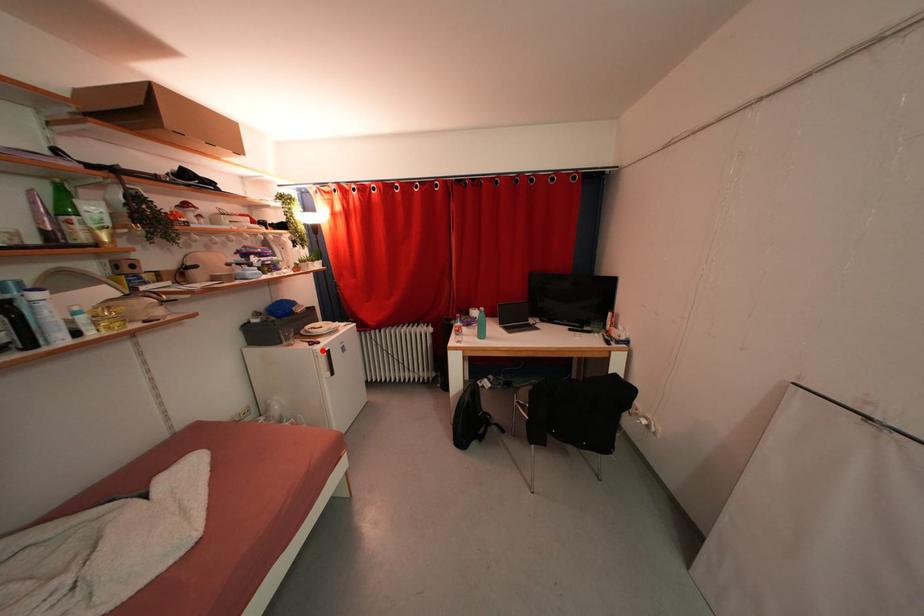
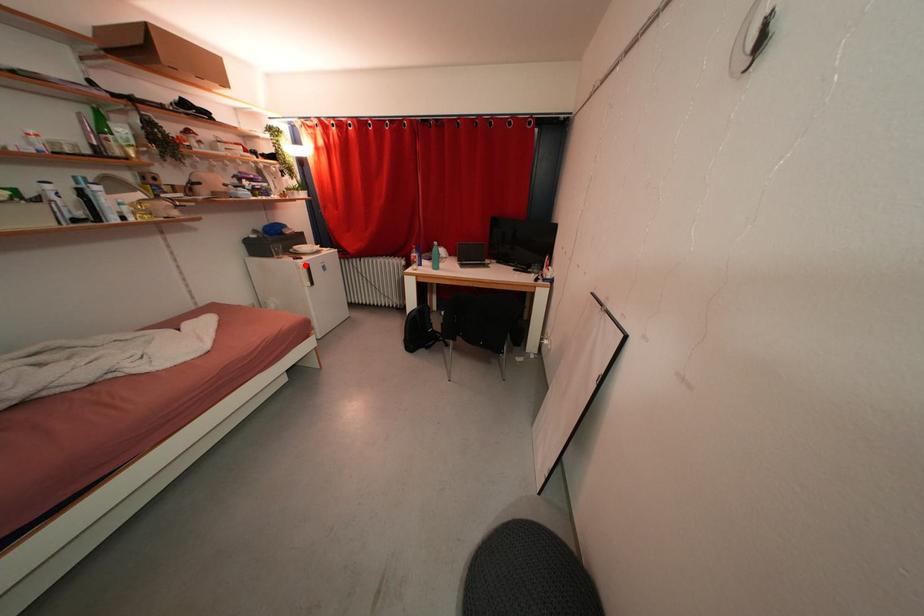
I am providing you with two images of the same scene from different viewpoints. A red point is marked on the first image and another point is marked on the second image. Are the points marked in image1 and image2 representing the same 3D position?

Yes